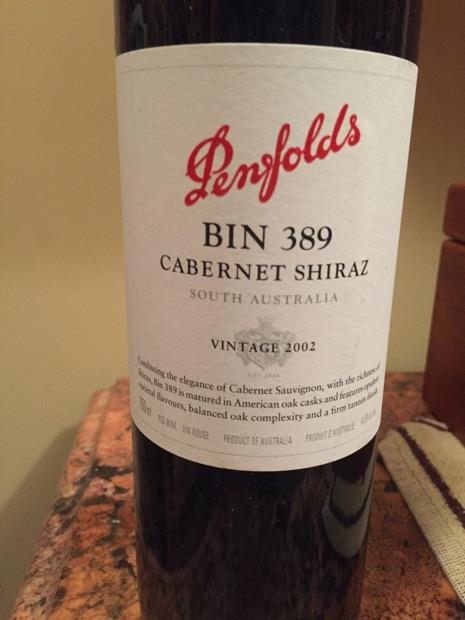
The width and height of the screenshot is (465, 620). I want to click on table, so click(x=415, y=583).